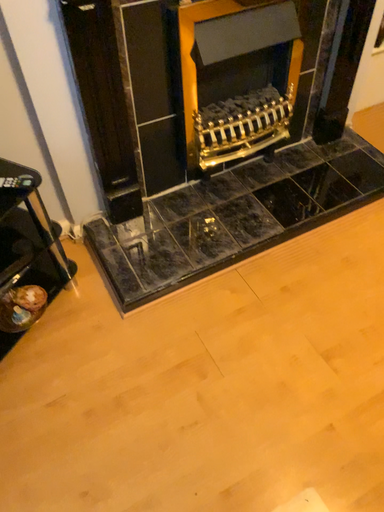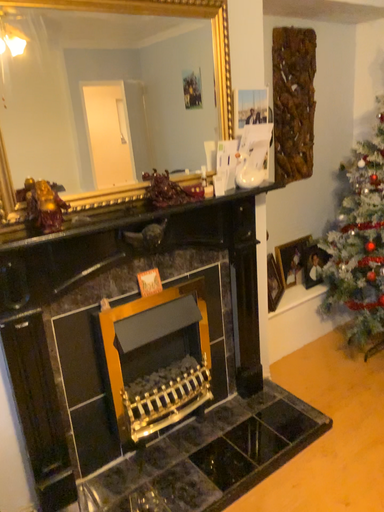
Question: Which way did the camera rotate in the video?

Choices:
 (A) rotated upward
 (B) rotated downward

Answer: (A)